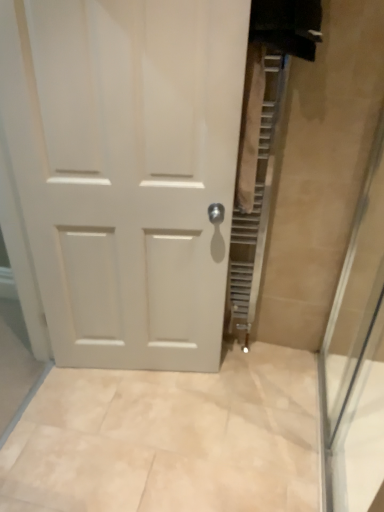
Question: In the image, is transparent glass shower door at right positioned in front of or behind white matte door at center?

Choices:
 (A) behind
 (B) front

Answer: (B)

Question: From a real-world perspective, is transparent glass shower door at right above or below white matte door at center?

Choices:
 (A) below
 (B) above

Answer: (A)

Question: In terms of width, does transparent glass shower door at right look wider or thinner when compared to white matte door at center?

Choices:
 (A) thin
 (B) wide

Answer: (A)

Question: Does point (178, 14) appear closer or farther from the camera than point (370, 159)?

Choices:
 (A) farther
 (B) closer

Answer: (B)

Question: Considering the positions of white matte door at center and transparent glass shower door at right in the image, is white matte door at center wider or thinner than transparent glass shower door at right?

Choices:
 (A) thin
 (B) wide

Answer: (B)

Question: Is white matte door at center bigger or smaller than transparent glass shower door at right?

Choices:
 (A) big
 (B) small

Answer: (A)

Question: Is white matte door at center inside the boundaries of transparent glass shower door at right, or outside?

Choices:
 (A) outside
 (B) inside

Answer: (A)